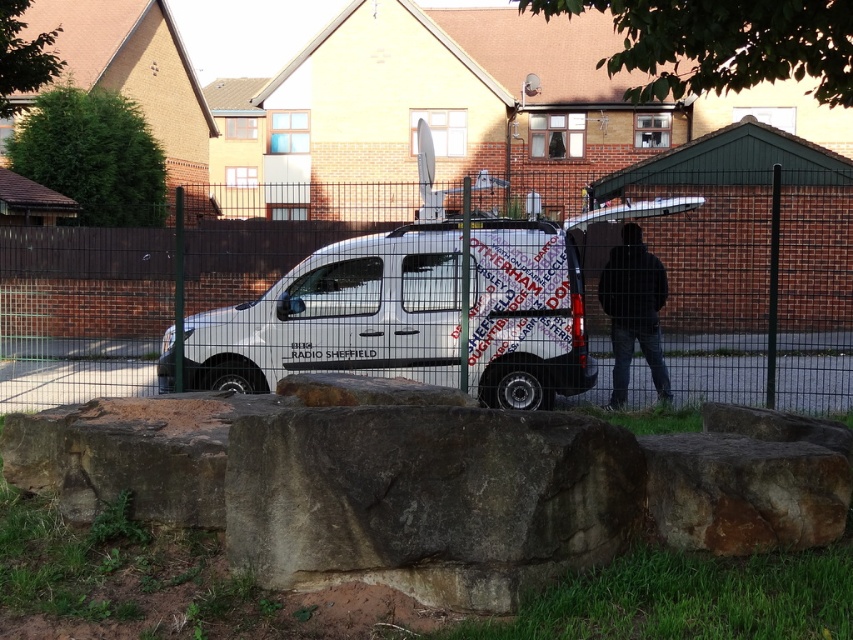
Question: Does brown rough stone at center have a lesser width compared to black fabric jacket at center?

Choices:
 (A) no
 (B) yes

Answer: (A)

Question: Which point appears closest to the camera in this image?

Choices:
 (A) (430, 262)
 (B) (608, 272)
 (C) (792, 486)
 (D) (294, 333)

Answer: (C)

Question: Among these objects, which one is nearest to the camera?

Choices:
 (A) brown rough stone at center
 (B) metal wire mesh fence at center
 (C) white metallic van at center

Answer: (A)

Question: Does metal wire mesh fence at center lie behind black fabric jacket at center?

Choices:
 (A) yes
 (B) no

Answer: (B)

Question: Which point appears farthest from the camera in this image?

Choices:
 (A) (734, 545)
 (B) (196, 352)
 (C) (809, 400)

Answer: (B)

Question: Is metal wire mesh fence at center further to the viewer compared to brown rough stone at lower right?

Choices:
 (A) no
 (B) yes

Answer: (B)